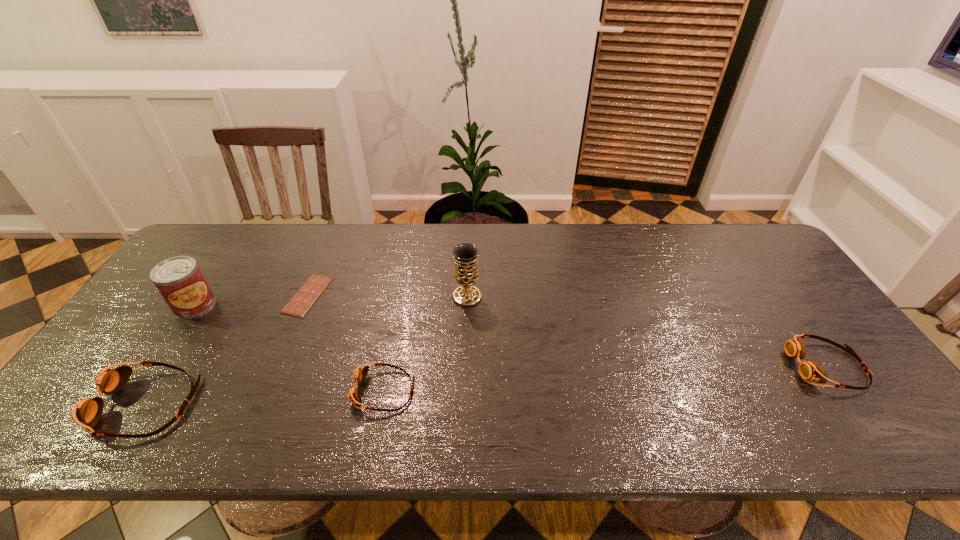
Where is `the fourth shortest object`? The height and width of the screenshot is (540, 960). the fourth shortest object is located at coordinates point(87,413).

Locate an element on the screen. This screenshot has width=960, height=540. the leftmost goggles is located at coordinates (87, 413).

Where is `the shortest goggles`? Image resolution: width=960 pixels, height=540 pixels. the shortest goggles is located at coordinates (360, 374).

Image resolution: width=960 pixels, height=540 pixels. Find the location of `the fifth tallest object`. the fifth tallest object is located at coordinates (360, 374).

Image resolution: width=960 pixels, height=540 pixels. What are the coordinates of `the rightmost goggles` in the screenshot? It's located at (809, 370).

This screenshot has width=960, height=540. I want to click on the rightmost object, so click(809, 370).

Locate an element on the screen. Image resolution: width=960 pixels, height=540 pixels. the fifth shortest object is located at coordinates (179, 280).

Locate an element on the screen. chocolate bar is located at coordinates (302, 301).

Locate an element on the screen. Image resolution: width=960 pixels, height=540 pixels. the shortest object is located at coordinates (302, 301).

You are a GUI agent. You are given a task and a screenshot of the screen. Output one action in this format:
    pyautogui.click(x=<x>, y=<y>)
    Task: Click on the chalice
    The height and width of the screenshot is (540, 960).
    Given the screenshot: What is the action you would take?
    pyautogui.click(x=465, y=255)